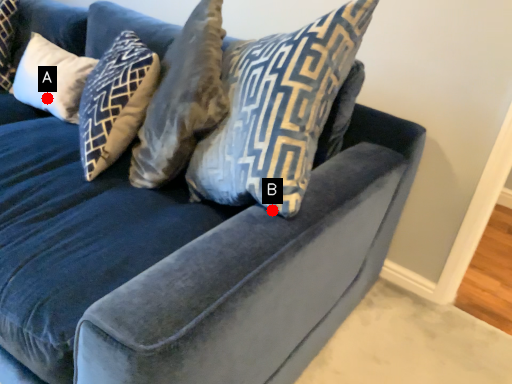
Question: Two points are circled on the image, labeled by A and B beside each circle. Which point is closer to the camera taking this photo?

Choices:
 (A) A is closer
 (B) B is closer

Answer: (B)